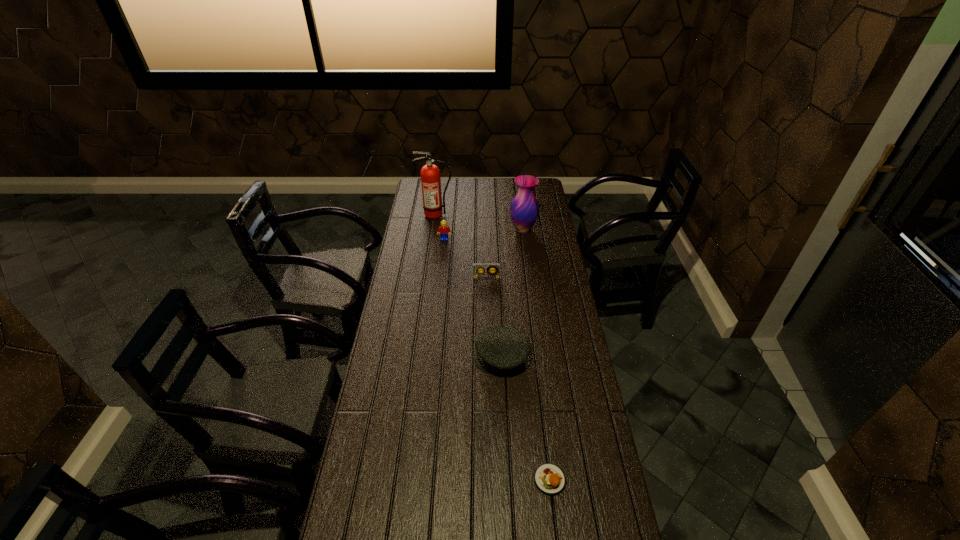
Locate an element on the screen. This screenshot has height=540, width=960. fire extinguisher is located at coordinates (430, 174).

Where is `the tallest object`? This screenshot has width=960, height=540. the tallest object is located at coordinates (430, 174).

This screenshot has height=540, width=960. Identify the location of the fifth shortest object. (524, 210).

You are a GUI agent. You are given a task and a screenshot of the screen. Output one action in this format:
    pyautogui.click(x=<x>, y=<y>)
    Task: Click on the Lego
    The height and width of the screenshot is (540, 960).
    Given the screenshot: What is the action you would take?
    pyautogui.click(x=443, y=230)

The image size is (960, 540). Identify the location of the fifth farthest object. (499, 348).

The height and width of the screenshot is (540, 960). In order to click on the third shortest object in this screenshot , I will do `click(499, 348)`.

The image size is (960, 540). In order to click on videotape in this screenshot , I will do `click(487, 273)`.

The height and width of the screenshot is (540, 960). I want to click on the fifth tallest object, so click(487, 273).

Identify the location of the nearest object. The image size is (960, 540). (549, 479).

This screenshot has width=960, height=540. What are the coordinates of `the shortest object` in the screenshot? It's located at (549, 479).